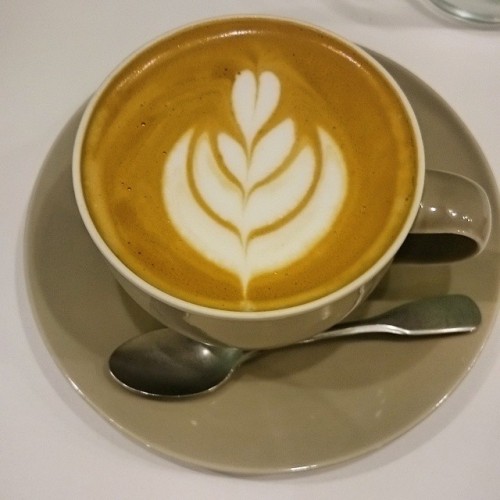
The height and width of the screenshot is (500, 500). I want to click on mug handle, so click(432, 181), click(435, 248).